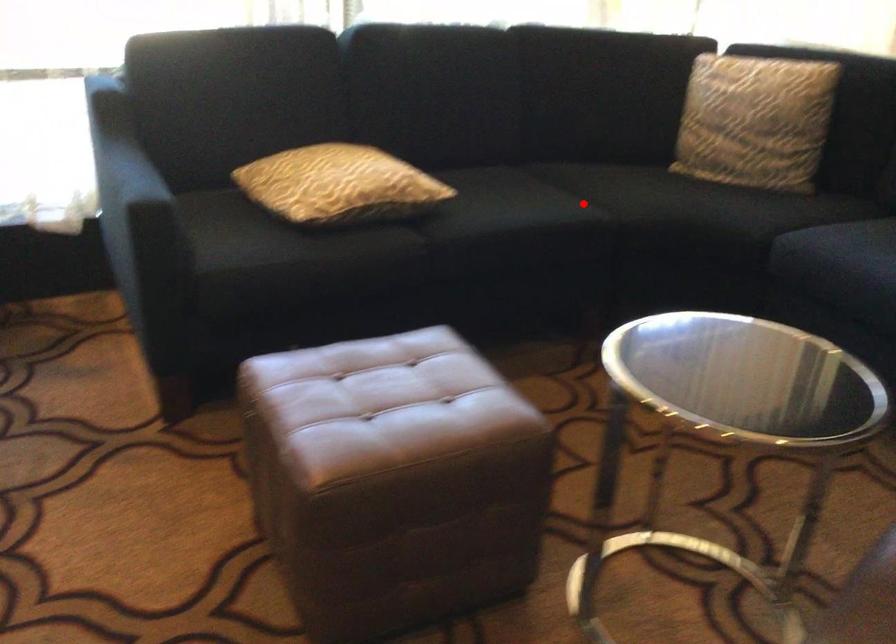
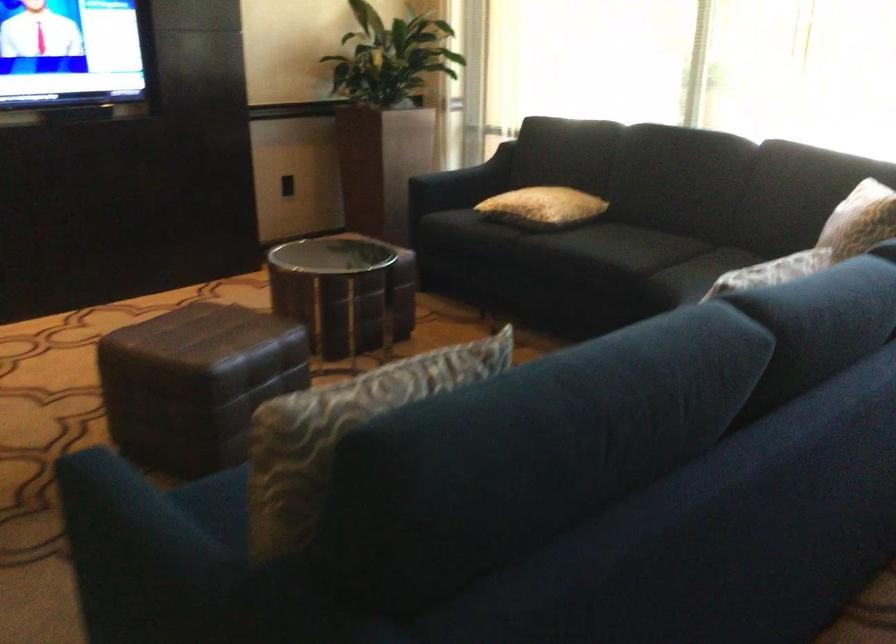
Find the pixel in the second image that matches the highlighted location in the first image.

(626, 254)